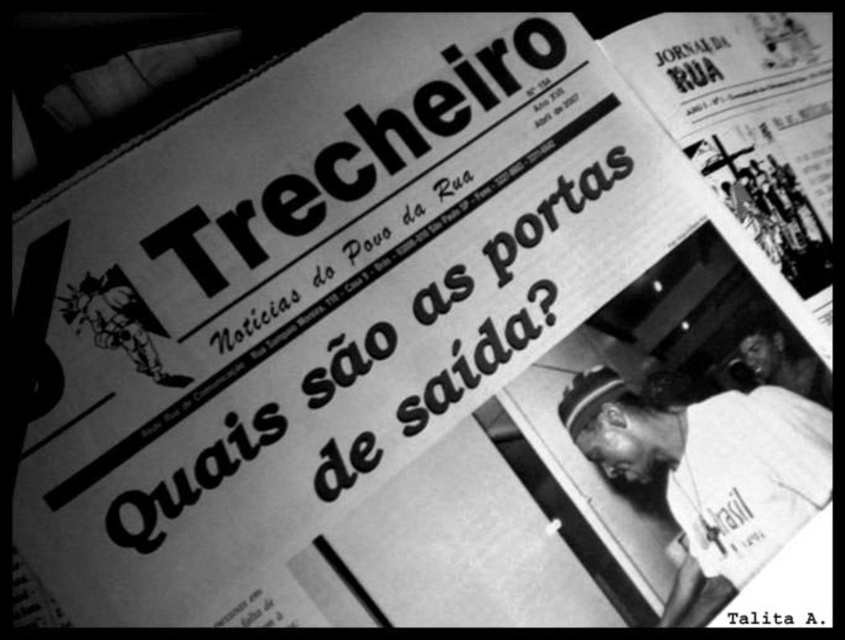
Does white fabric cap at center appear under smooth skin face at lower right?

Yes.

Can you confirm if white fabric cap at center is thinner than smooth skin face at lower right?

No, white fabric cap at center is not thinner than smooth skin face at lower right.

At what (x,y) coordinates should I click in order to perform the action: click on white fabric cap at center. Please return your answer as a coordinate pair (x, y). Image resolution: width=845 pixels, height=640 pixels. Looking at the image, I should click on (710, 472).

At what (x,y) coordinates should I click in order to perform the action: click on white fabric cap at center. Please return your answer as a coordinate pair (x, y). Image resolution: width=845 pixels, height=640 pixels. Looking at the image, I should click on (710, 472).